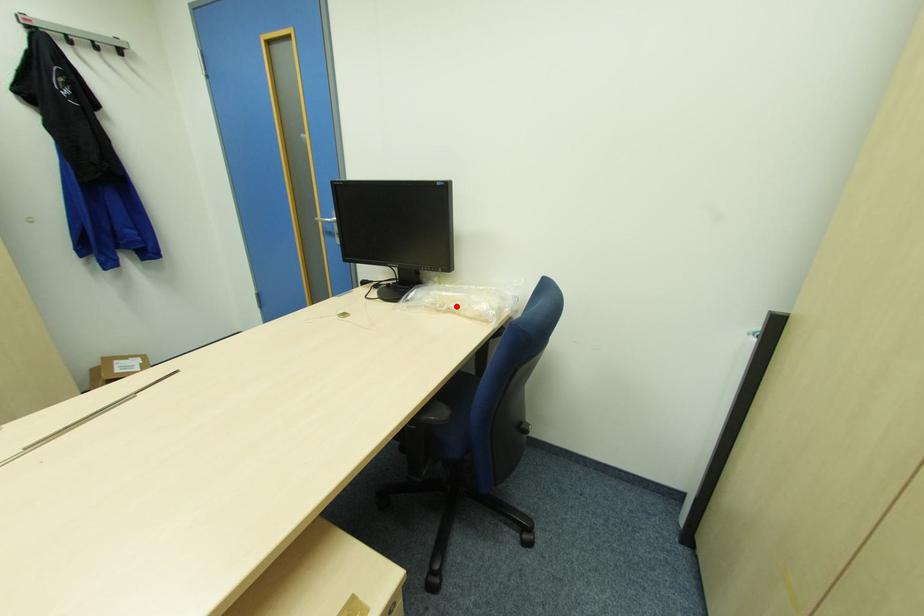
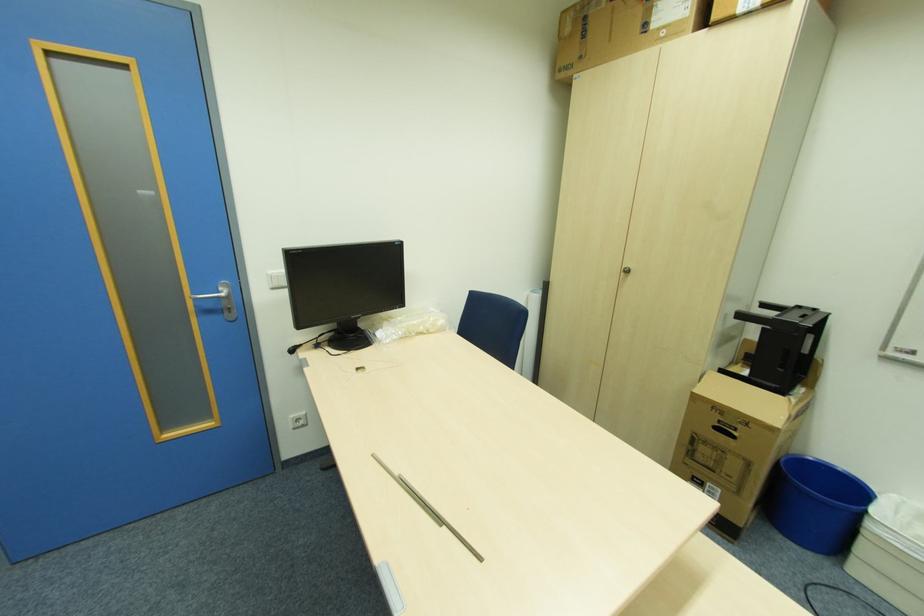
In the second image, find the point that corresponds to the highlighted location in the first image.

(424, 329)